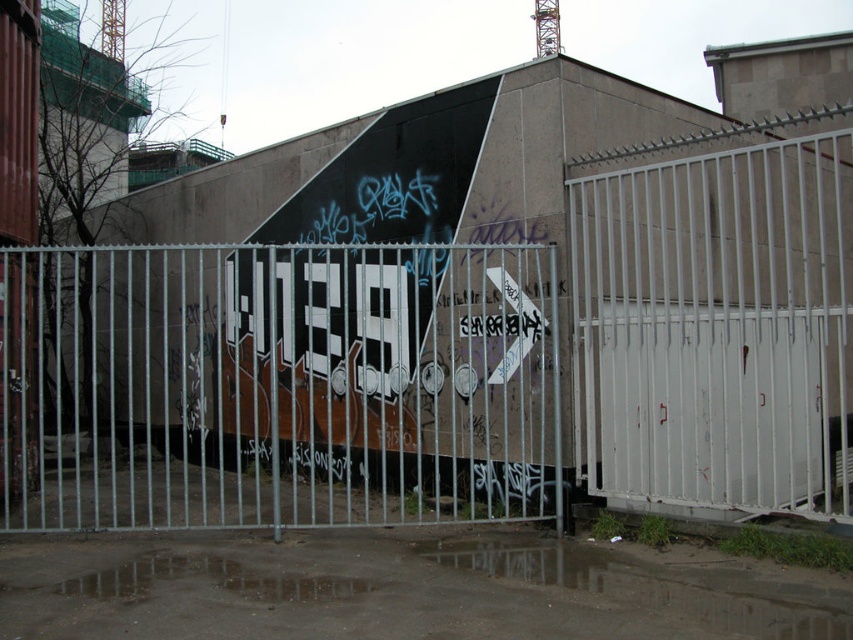
How distant is metallic silver gate at center from white metal gate at right?

metallic silver gate at center is 6.61 meters away from white metal gate at right.

Is metallic silver gate at center to the right of white metal gate at right from the viewer's perspective?

Incorrect, metallic silver gate at center is not on the right side of white metal gate at right.

Which is behind, point (276, 529) or point (732, 244)?

Point (732, 244)

Where is `metallic silver gate at center`? The image size is (853, 640). metallic silver gate at center is located at coordinates (276, 387).

Who is positioned more to the left, white metal fence at center or metallic silver gate at center?

From the viewer's perspective, metallic silver gate at center appears more on the left side.

Does white metal fence at center have a lesser height compared to metallic silver gate at center?

Incorrect, white metal fence at center's height does not fall short of metallic silver gate at center's.

Where is `white metal fence at center`? white metal fence at center is located at coordinates (454, 356).

Where is `white metal fence at center`? This screenshot has height=640, width=853. white metal fence at center is located at coordinates (454, 356).

Who is higher up, white metal fence at center or white metal gate at right?

white metal fence at center is above.

Who is more forward, (314,282) or (675,433)?

Point (675,433) is more forward.

I want to click on white metal fence at center, so click(454, 356).